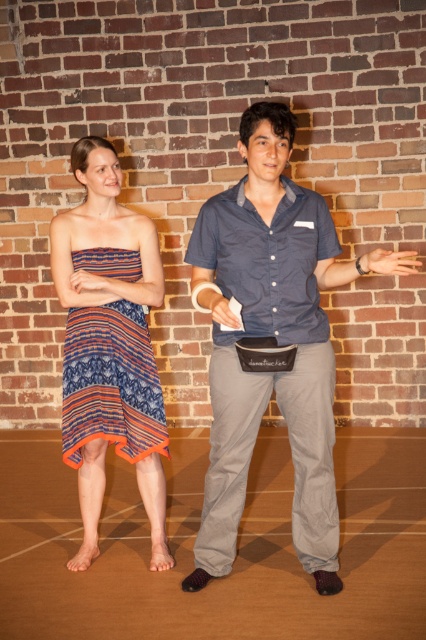
Question: Which of the following is the closest to the observer?

Choices:
 (A) (252, 408)
 (B) (106, 145)

Answer: (A)

Question: Does matte blue shirt at center appear under textured cotton dress at center?

Choices:
 (A) yes
 (B) no

Answer: (B)

Question: Is striped fabric dress at center to the right of textured cotton dress at center from the viewer's perspective?

Choices:
 (A) no
 (B) yes

Answer: (A)

Question: From the image, what is the correct spatial relationship of striped fabric dress at center in relation to textured cotton dress at center?

Choices:
 (A) right
 (B) left

Answer: (B)

Question: Estimate the real-world distances between objects in this image. Which object is farther from the striped fabric dress at center?

Choices:
 (A) textured cotton dress at center
 (B) matte blue shirt at center

Answer: (B)

Question: Which point is farther from the camera taking this photo?

Choices:
 (A) (104, 396)
 (B) (85, 352)

Answer: (B)